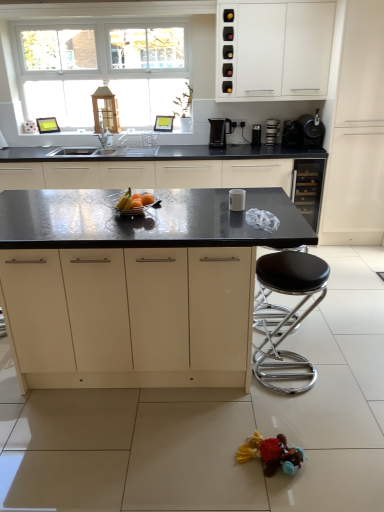
Question: Does matte white cabinet at right, marked as the 1th cabinetry in a right-to-left arrangement, come behind metallic silver coffee maker at upper right, the second appliance positioned from the back?

Choices:
 (A) yes
 (B) no

Answer: (B)

Question: From the image's perspective, is matte white cabinet at right, marked as the 1th cabinetry in a right-to-left arrangement, above metallic silver coffee maker at upper right, the second appliance positioned from the back?

Choices:
 (A) yes
 (B) no

Answer: (B)

Question: From the image's perspective, is matte white cabinet at right, marked as the 1th cabinetry in a right-to-left arrangement, beneath metallic silver coffee maker at upper right, which is counted as the first appliance, starting from the top?

Choices:
 (A) no
 (B) yes

Answer: (B)

Question: Is matte white cabinet at right, marked as the 1th cabinetry in a right-to-left arrangement, placed right next to metallic silver coffee maker at upper right, positioned as the second appliance in right-to-left order?

Choices:
 (A) no
 (B) yes

Answer: (A)

Question: Is matte white cabinet at right, the 5th cabinetry from the left, aimed at metallic silver coffee maker at upper right, positioned as the second appliance in right-to-left order?

Choices:
 (A) no
 (B) yes

Answer: (A)

Question: Is matte black countertop at center, arranged as the 4th cabinetry when viewed from the right, taller or shorter than black plastic toaster at upper center, which is the 4th appliance from front to back?

Choices:
 (A) short
 (B) tall

Answer: (B)

Question: From a real-world perspective, is matte black countertop at center, arranged as the 4th cabinetry when viewed from the right, above or below black plastic toaster at upper center, which is the 4th appliance from front to back?

Choices:
 (A) above
 (B) below

Answer: (B)

Question: Considering the positions of matte black countertop at center, arranged as the 4th cabinetry when viewed from the right, and black plastic toaster at upper center, acting as the 2th appliance starting from the top, in the image, is matte black countertop at center, arranged as the 4th cabinetry when viewed from the right, bigger or smaller than black plastic toaster at upper center, acting as the 2th appliance starting from the top,?

Choices:
 (A) small
 (B) big

Answer: (B)

Question: From the image's perspective, is matte black countertop at center, arranged as the 4th cabinetry when viewed from the right, positioned above or below black plastic toaster at upper center, which is the third appliance in bottom-to-top order?

Choices:
 (A) above
 (B) below

Answer: (B)

Question: Does point (278, 31) appear closer or farther from the camera than point (246, 452)?

Choices:
 (A) farther
 (B) closer

Answer: (A)

Question: Looking at their shapes, would you say white matte cabinet at upper right, the third cabinetry viewed from the right, is wider or thinner than multicolored fabric toy at lower right?

Choices:
 (A) wide
 (B) thin

Answer: (A)

Question: Is white matte cabinet at upper right, acting as the third cabinetry starting from the left, bigger or smaller than multicolored fabric toy at lower right?

Choices:
 (A) big
 (B) small

Answer: (A)

Question: Considering their positions, is white matte cabinet at upper right, acting as the third cabinetry starting from the left, located in front of or behind multicolored fabric toy at lower right?

Choices:
 (A) front
 (B) behind

Answer: (B)

Question: Looking at their shapes, would you say shiny metallic bowl at center is wider or thinner than metallic silver coffee maker at upper right, the second appliance positioned from the back?

Choices:
 (A) wide
 (B) thin

Answer: (A)

Question: In the image, is shiny metallic bowl at center positioned in front of or behind metallic silver coffee maker at upper right, placed as the third appliance when sorted from left to right?

Choices:
 (A) behind
 (B) front

Answer: (B)